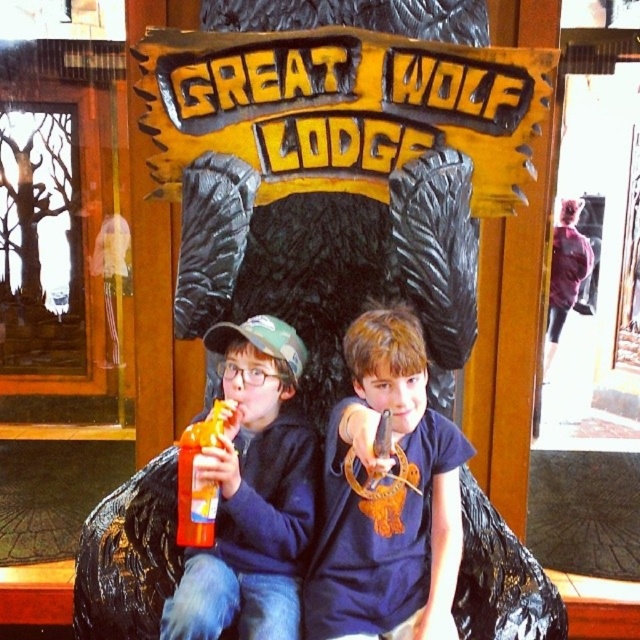
Question: Which point appears closest to the camera in this image?

Choices:
 (A) (180, 508)
 (B) (458, 497)
 (C) (209, 611)

Answer: (C)

Question: Does blue matte shirt at center appear over orange plastic bottle at center?

Choices:
 (A) yes
 (B) no

Answer: (A)

Question: Considering the relative positions of matte plastic soda at left and orange plastic bottle at center in the image provided, where is matte plastic soda at left located with respect to orange plastic bottle at center?

Choices:
 (A) left
 (B) right

Answer: (B)

Question: Which is farther from the matte plastic soda at left?

Choices:
 (A) orange plastic bottle at center
 (B) blue matte shirt at center

Answer: (B)

Question: Which point appears closest to the camera in this image?

Choices:
 (A) (358, 586)
 (B) (218, 339)
 (C) (188, 429)

Answer: (C)

Question: Can you confirm if matte plastic soda at left is bigger than orange plastic bottle at center?

Choices:
 (A) no
 (B) yes

Answer: (B)